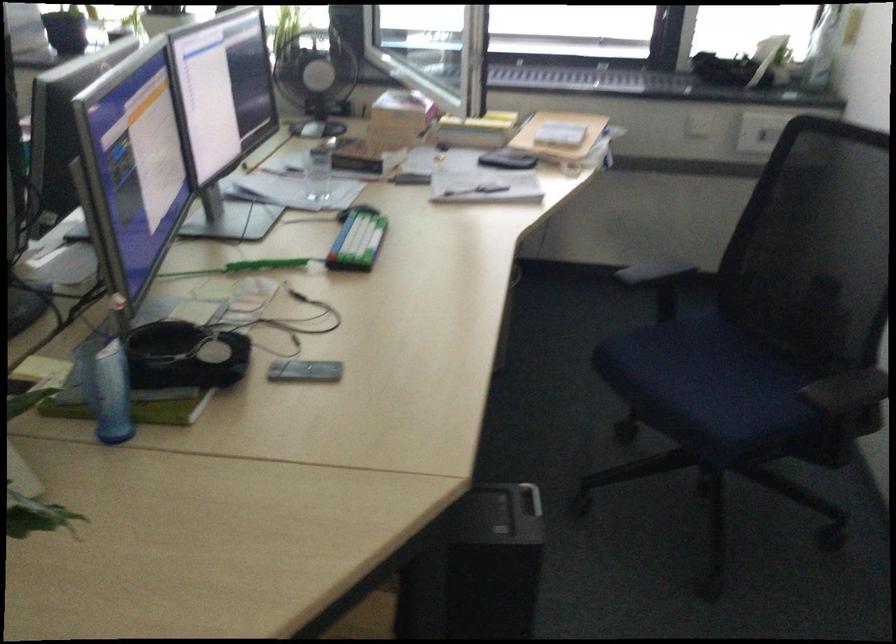
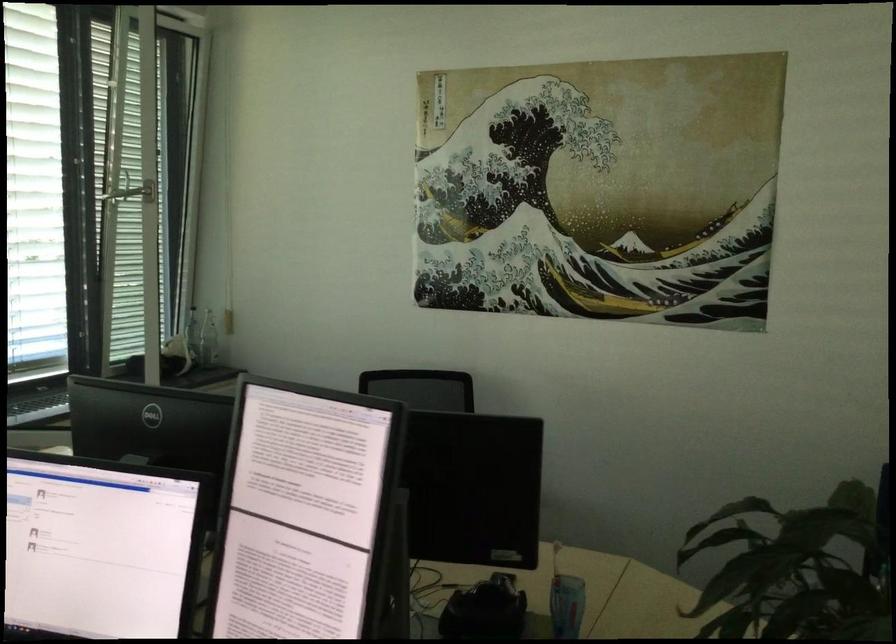
Find the pixel in the second image that matches (138,427) in the first image.

(566, 605)